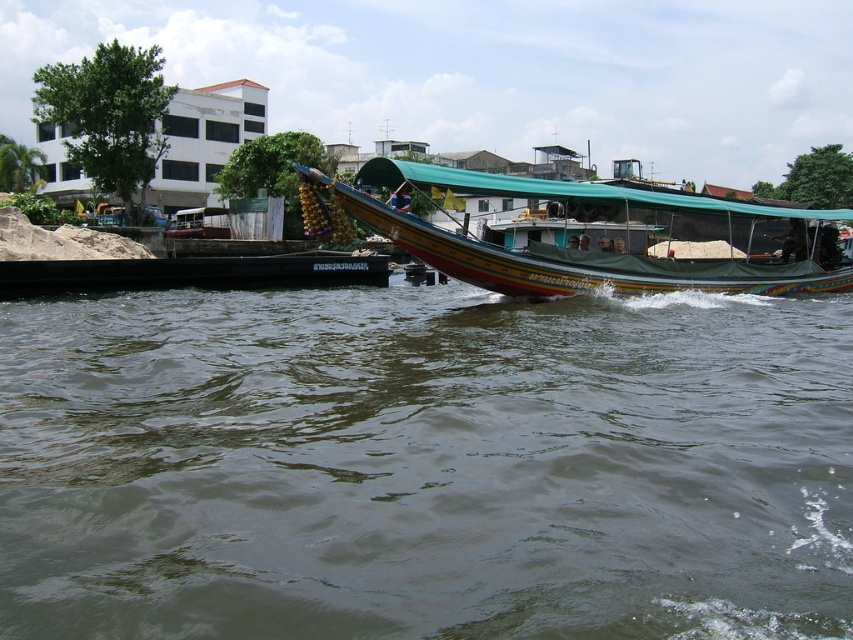
Question: Where is brown murky water at center located in relation to multicolored painted boat at center in the image?

Choices:
 (A) above
 (B) below

Answer: (B)

Question: Is brown murky water at center to the left of multicolored painted boat at center from the viewer's perspective?

Choices:
 (A) yes
 (B) no

Answer: (B)

Question: Which point appears closest to the camera in this image?

Choices:
 (A) (492, 280)
 (B) (172, 417)

Answer: (B)

Question: Does brown murky water at center appear over multicolored painted boat at center?

Choices:
 (A) yes
 (B) no

Answer: (B)